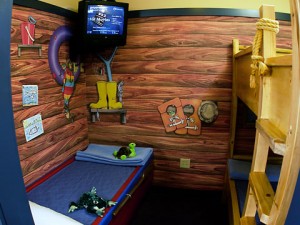
In order to click on 1 upper bed in this screenshot , I will do `click(282, 59)`.